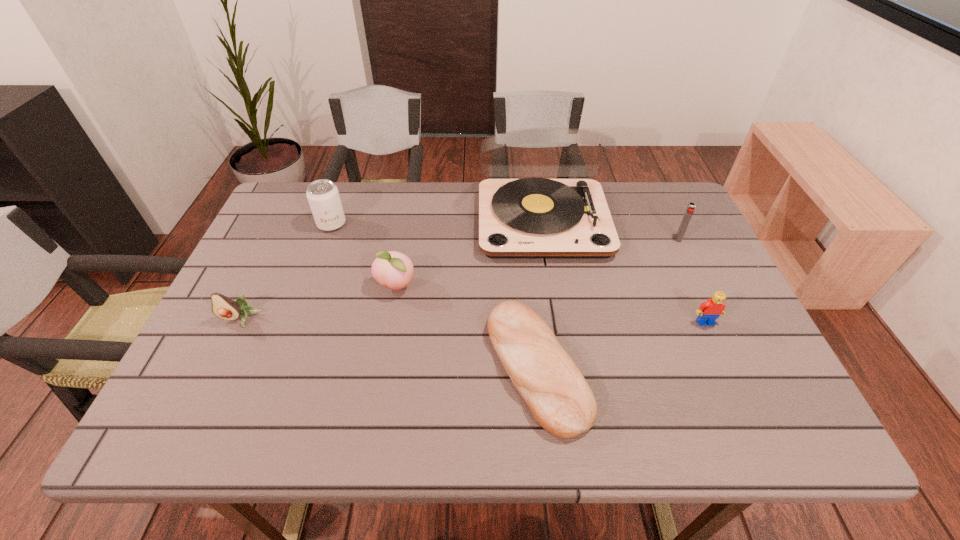
Locate an element on the screen. The width and height of the screenshot is (960, 540). vacant space located on the left of the igniter is located at coordinates (565, 239).

This screenshot has height=540, width=960. In order to click on blank space located 0.110m on the left of the peach in this screenshot , I will do `click(332, 286)`.

I want to click on free spot located 0.170m on the face of the Lego, so click(736, 392).

I want to click on vacant space positioned 0.140m on the seed side of the avocado, so (211, 381).

Identify the location of vacant area situated on the back of the bread. (526, 265).

Where is `record player that is at the far edge`? record player that is at the far edge is located at coordinates (529, 218).

Where is `soda can situated at the far edge`? The height and width of the screenshot is (540, 960). soda can situated at the far edge is located at coordinates (323, 196).

I want to click on object that is positioned at the near edge, so (561, 401).

Where is `soda can that is at the left edge`? The image size is (960, 540). soda can that is at the left edge is located at coordinates (323, 196).

You are a GUI agent. You are given a task and a screenshot of the screen. Output one action in this format:
    pyautogui.click(x=<x>, y=<y>)
    Task: Click on the avocado located at the left edge
    
    Given the screenshot: What is the action you would take?
    pyautogui.click(x=223, y=307)